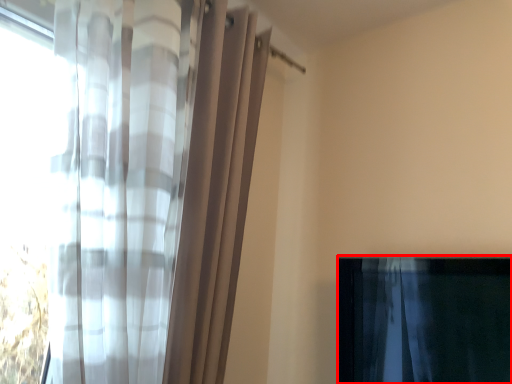
Question: In this image, where is curtain (annotated by the red box) located relative to curtain?

Choices:
 (A) left
 (B) right

Answer: (B)